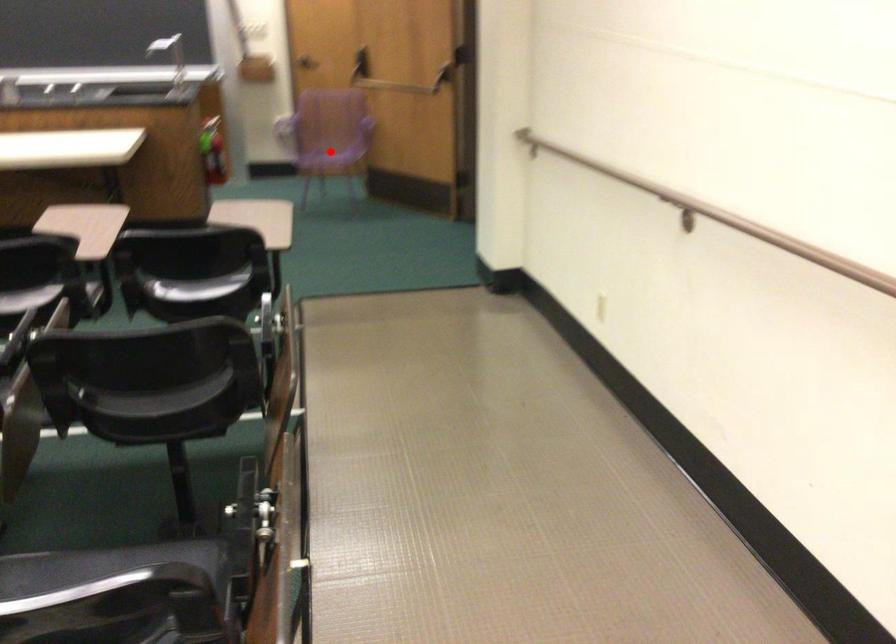
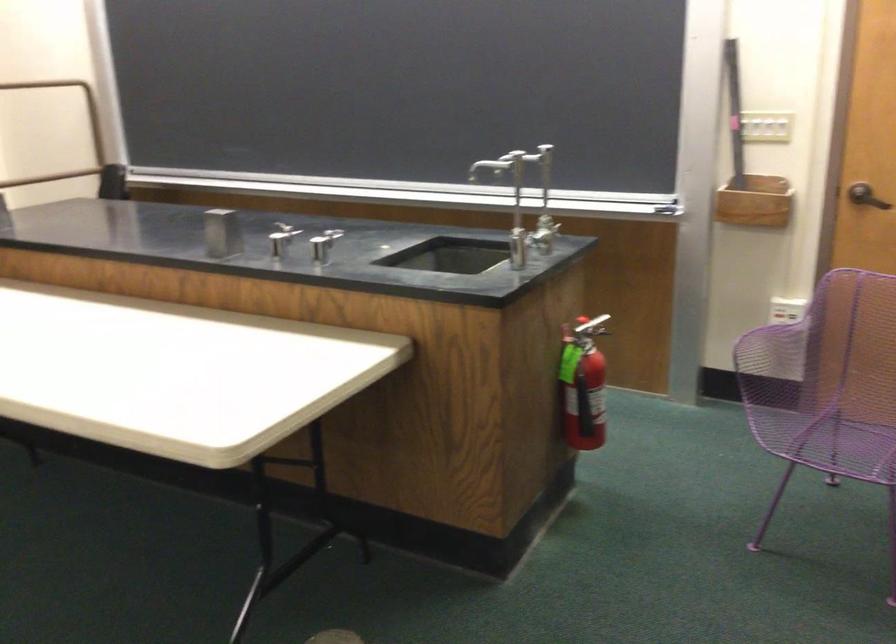
Locate, in the second image, the point that corresponds to the highlighted location in the first image.

(851, 415)